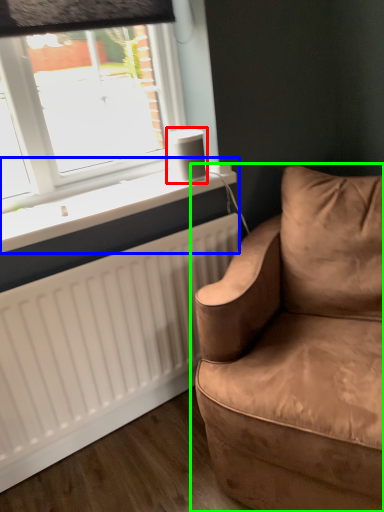
Question: Considering the real-world distances, which object is farthest from speaker (highlighted by a red box)? window sill (highlighted by a blue box) or studio couch (highlighted by a green box)?

Choices:
 (A) window sill
 (B) studio couch

Answer: (B)